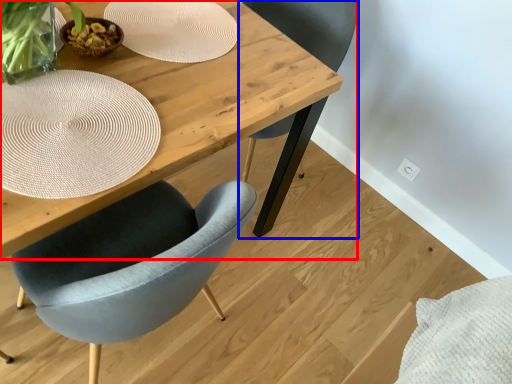
Question: Among these objects, which one is farthest to the camera, table (highlighted by a red box) or chair (highlighted by a blue box)?

Choices:
 (A) table
 (B) chair

Answer: (B)